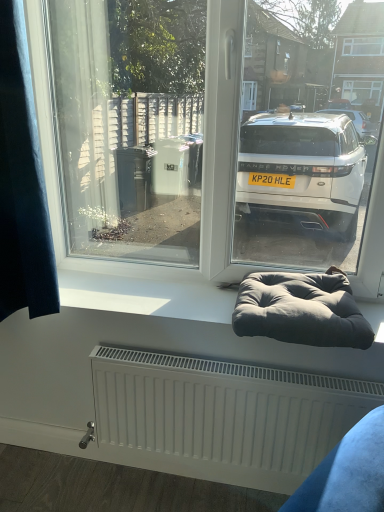
Identify the location of blank space situated above white matte window sill at center (from a real-world perspective). (153, 283).